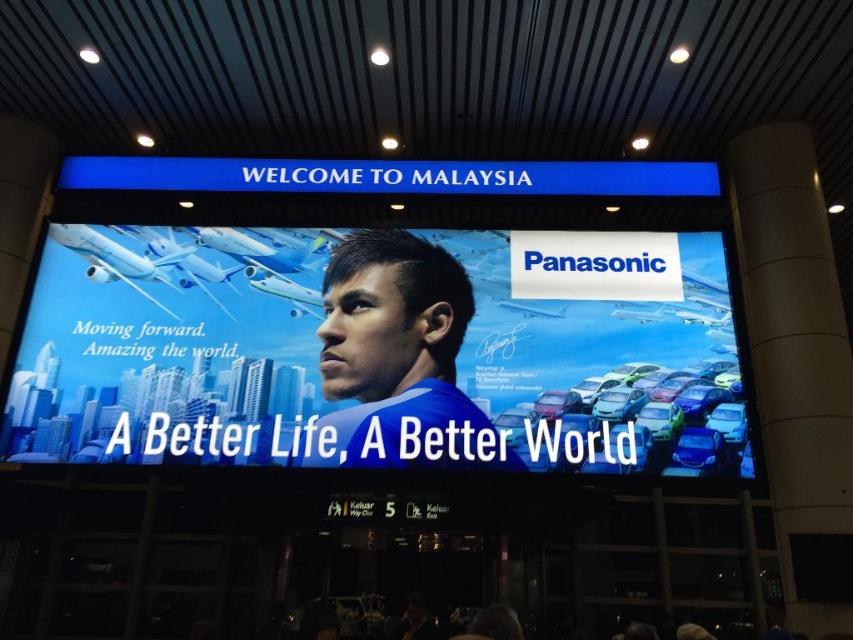
The width and height of the screenshot is (853, 640). What do you see at coordinates (379, 349) in the screenshot?
I see `blue glossy billboard at center` at bounding box center [379, 349].

Can you confirm if blue glossy billboard at center is positioned below blue fabric at center?

No, blue glossy billboard at center is not below blue fabric at center.

Where is `blue glossy billboard at center`? This screenshot has width=853, height=640. blue glossy billboard at center is located at coordinates (379, 349).

Which of these two, blue fabric at center or blue metallic signboard at upper center, stands taller?

blue fabric at center is taller.

Which is in front, point (432, 349) or point (103, 179)?

Point (432, 349)

Does point (354, 355) come farther from viewer compared to point (209, 172)?

No.

Find the location of a particular element. Image resolution: width=853 pixels, height=640 pixels. blue fabric at center is located at coordinates (397, 358).

Can you confirm if blue glossy billboard at center is positioned to the left of blue metallic signboard at upper center?

Yes, blue glossy billboard at center is to the left of blue metallic signboard at upper center.

Does point (554, 296) lie in front of point (341, 193)?

Yes, point (554, 296) is closer to viewer.

Find the location of a particular element. The width and height of the screenshot is (853, 640). blue glossy billboard at center is located at coordinates (379, 349).